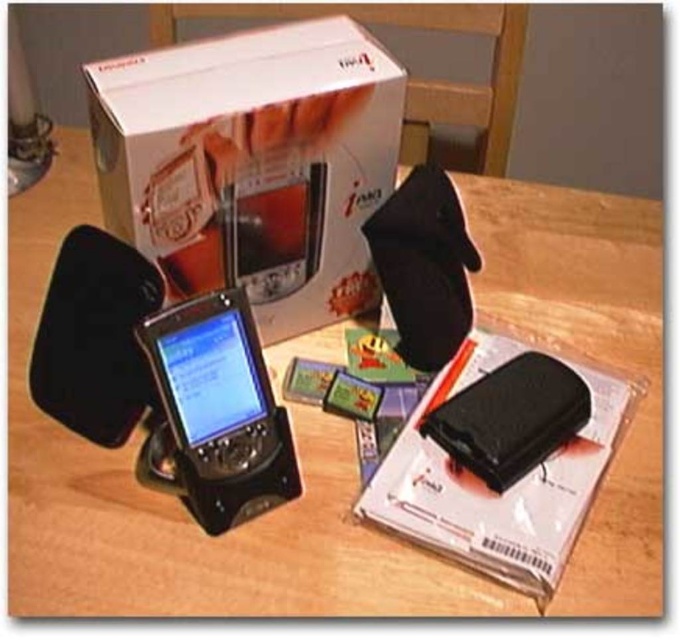
You are holding the matte black smartphone at center and want to place it on top of the white cardboard box at upper center. Is the smartphone currently positioned below the box?

The white cardboard box at upper center is above the matte black smartphone at center, so yes, the smartphone is positioned below the box and can be placed on top of it.